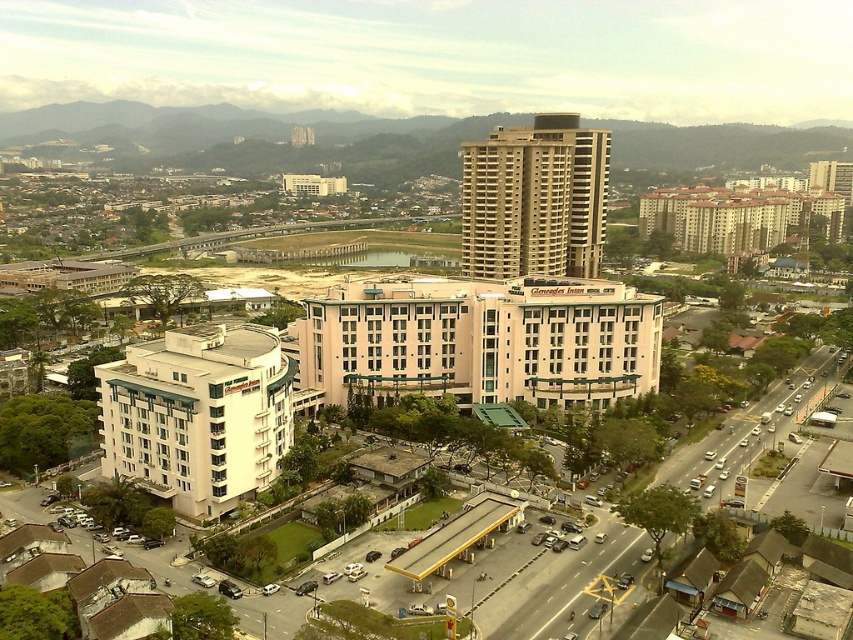
Question: Which point is closer to the camera?

Choices:
 (A) beige concrete building at center
 (B) pink concrete building at center

Answer: (B)

Question: Observing the image, what is the correct spatial positioning of pink concrete building at center in reference to beige concrete building at center?

Choices:
 (A) below
 (B) above

Answer: (A)

Question: Considering the real-world distances, which object is farthest from the pink concrete building at center?

Choices:
 (A) beige concrete building at center
 (B) white glossy building at lower left

Answer: (A)

Question: Does pink concrete building at center have a smaller size compared to beige concrete building at center?

Choices:
 (A) yes
 (B) no

Answer: (A)

Question: Which point is farther from the camera taking this photo?

Choices:
 (A) (222, 340)
 (B) (561, 372)
 (C) (509, 252)

Answer: (C)

Question: Is the position of pink concrete building at center more distant than that of beige concrete building at center?

Choices:
 (A) yes
 (B) no

Answer: (B)